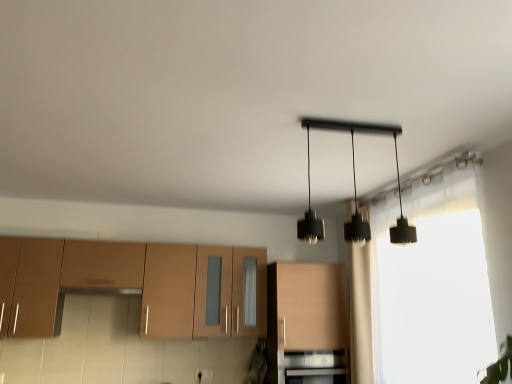
Question: Is black matte pendant lights at center to the left or to the right of translucent fabric curtain at right in the image?

Choices:
 (A) right
 (B) left

Answer: (B)

Question: Considering their positions, is black matte pendant lights at center located in front of or behind translucent fabric curtain at right?

Choices:
 (A) behind
 (B) front

Answer: (B)

Question: Which object is the farthest from the matte wood cabinet at center, the 1th cabinetry positioned from the right?

Choices:
 (A) brown matte cabinet at lower left, marked as the 1th cabinetry in a left-to-right arrangement
 (B) beige fabric curtain at center-right
 (C) black matte pendant lights at center
 (D) translucent fabric curtain at right
 (E) black matte oven at lower center

Answer: (C)

Question: Estimate the real-world distances between objects in this image. Which object is closer to the translucent fabric curtain at right?

Choices:
 (A) matte wood cabinet at center, the second cabinetry when ordered from left to right
 (B) beige fabric curtain at center-right
 (C) black matte pendant lights at center
 (D) brown matte cabinet at lower left, marked as the 1th cabinetry in a left-to-right arrangement
 (E) black matte oven at lower center

Answer: (B)